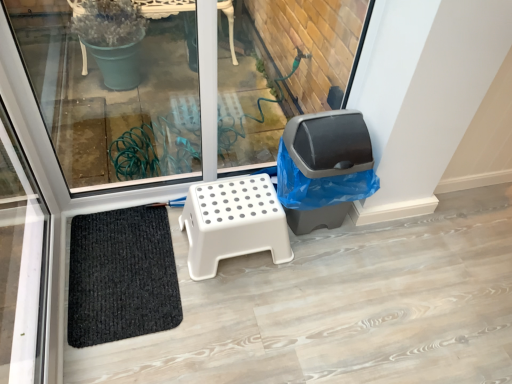
The height and width of the screenshot is (384, 512). Identify the location of free space above white plastic stool at center (from a real-world perspective). (230, 196).